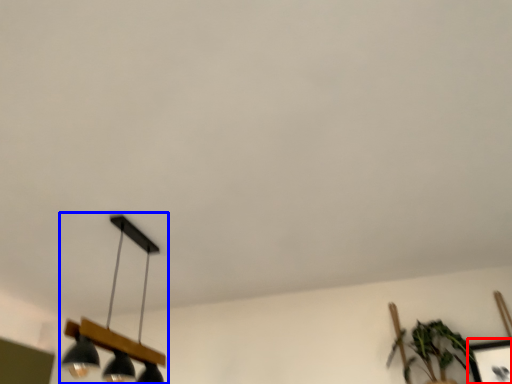
Question: Which object appears farthest to the camera in this image, picture frame (highlighted by a red box) or lamp (highlighted by a blue box)?

Choices:
 (A) picture frame
 (B) lamp

Answer: (A)